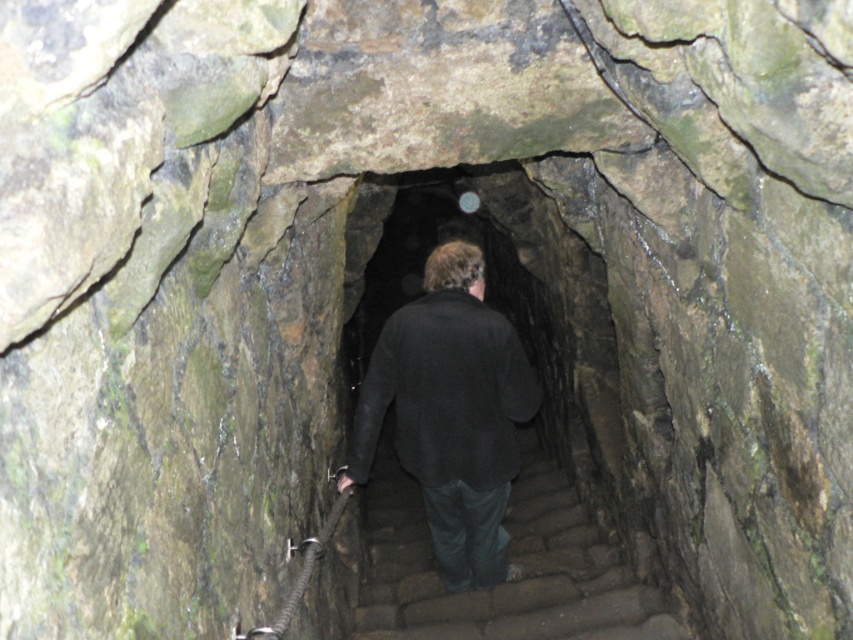
Is black matte jacket at center thinner than brown stone stairs at center?

Yes.

Is black matte jacket at center above brown stone stairs at center?

Yes, black matte jacket at center is above brown stone stairs at center.

Is point (463, 424) closer to viewer compared to point (448, 616)?

Yes, it is in front of point (448, 616).

Locate an element on the screen. black matte jacket at center is located at coordinates (450, 412).